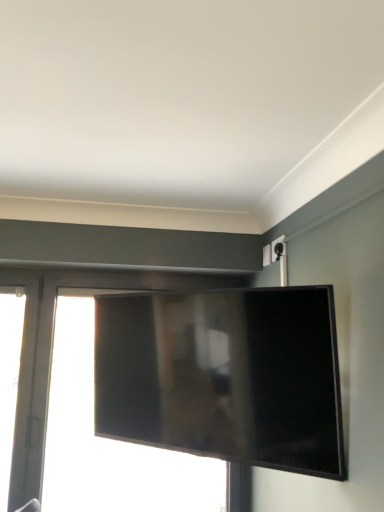
Question: Are transparent glass window at center, arranged as the first window when viewed from the right, and transparent glass window at left, marked as the first window in a left-to-right arrangement, far apart?

Choices:
 (A) yes
 (B) no

Answer: (B)

Question: Does transparent glass window at center, which appears as the second window when viewed from the left, have a larger size compared to transparent glass window at left, which is the second window from right to left?

Choices:
 (A) yes
 (B) no

Answer: (A)

Question: Is transparent glass window at center, arranged as the first window when viewed from the right, further to the viewer compared to transparent glass window at left, marked as the first window in a left-to-right arrangement?

Choices:
 (A) yes
 (B) no

Answer: (A)

Question: Can you confirm if transparent glass window at center, arranged as the first window when viewed from the right, is taller than transparent glass window at left, which is the second window from right to left?

Choices:
 (A) yes
 (B) no

Answer: (A)

Question: Is transparent glass window at center, arranged as the first window when viewed from the right, placed right next to transparent glass window at left, marked as the first window in a left-to-right arrangement?

Choices:
 (A) yes
 (B) no

Answer: (B)

Question: Considering their positions, is transparent glass window at left, marked as the first window in a left-to-right arrangement, located in front of or behind matte black tv at center?

Choices:
 (A) behind
 (B) front

Answer: (A)

Question: From the image's perspective, is transparent glass window at left, which is the second window from right to left, above or below matte black tv at center?

Choices:
 (A) above
 (B) below

Answer: (B)

Question: From a real-world perspective, relative to matte black tv at center, is transparent glass window at left, marked as the first window in a left-to-right arrangement, vertically above or below?

Choices:
 (A) above
 (B) below

Answer: (B)

Question: Based on their sizes in the image, would you say transparent glass window at left, marked as the first window in a left-to-right arrangement, is bigger or smaller than matte black tv at center?

Choices:
 (A) big
 (B) small

Answer: (B)

Question: Is transparent glass window at center, which appears as the second window when viewed from the left, in front of or behind matte black tv at center in the image?

Choices:
 (A) behind
 (B) front

Answer: (A)

Question: Is point pos(33,371) positioned closer to the camera than point pos(307,436)?

Choices:
 (A) farther
 (B) closer

Answer: (A)

Question: Is transparent glass window at center, arranged as the first window when viewed from the right, bigger or smaller than matte black tv at center?

Choices:
 (A) small
 (B) big

Answer: (B)

Question: From the image's perspective, is transparent glass window at center, arranged as the first window when viewed from the right, located above or below matte black tv at center?

Choices:
 (A) below
 (B) above

Answer: (A)

Question: Looking at their shapes, would you say matte black tv at center is wider or thinner than transparent glass window at left, marked as the first window in a left-to-right arrangement?

Choices:
 (A) wide
 (B) thin

Answer: (A)

Question: From a real-world perspective, is matte black tv at center above or below transparent glass window at left, which is the second window from right to left?

Choices:
 (A) below
 (B) above

Answer: (B)